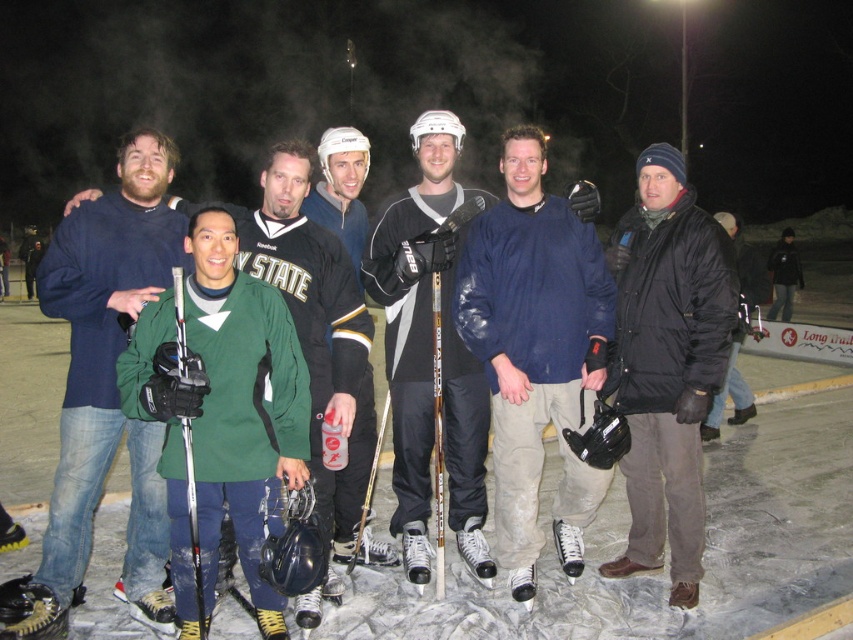
Can you confirm if black puffy jacket at center is thinner than green matte hockey jersey at center?

Indeed, black puffy jacket at center has a lesser width compared to green matte hockey jersey at center.

Does black puffy jacket at center have a greater height compared to green matte hockey jersey at center?

Yes.

Does point (641, 403) lie behind point (346, 218)?

That is False.

I want to click on black puffy jacket at center, so click(x=666, y=364).

Does point (561, 307) lie behind point (637, 419)?

No.

Between matte blue hockey jersey at center and black puffy jacket at center, which one has more height?

matte blue hockey jersey at center

Describe the element at coordinates (537, 349) in the screenshot. I see `matte blue hockey jersey at center` at that location.

Locate an element on the screen. The width and height of the screenshot is (853, 640). matte blue hockey jersey at center is located at coordinates (537, 349).

Looking at this image, how much distance is there between green matte hockey jersey at center and black matte jacket at center?

3.52 meters

Describe the element at coordinates (344, 195) in the screenshot. This screenshot has width=853, height=640. I see `green matte hockey jersey at center` at that location.

You are a GUI agent. You are given a task and a screenshot of the screen. Output one action in this format:
    pyautogui.click(x=<x>, y=<y>)
    Task: Click on the green matte hockey jersey at center
    This screenshot has width=853, height=640.
    Given the screenshot: What is the action you would take?
    pyautogui.click(x=344, y=195)